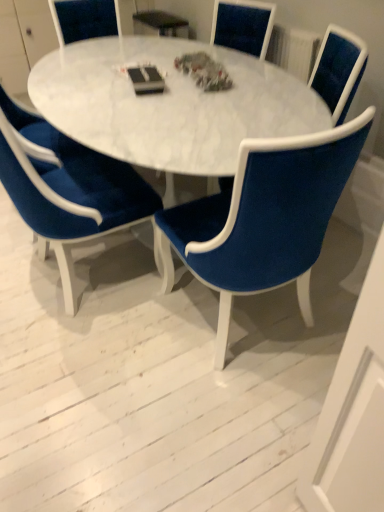
The width and height of the screenshot is (384, 512). Identify the location of free space in front of velvet blue chair at center, which is the 2th chair in left-to-right order. (216, 422).